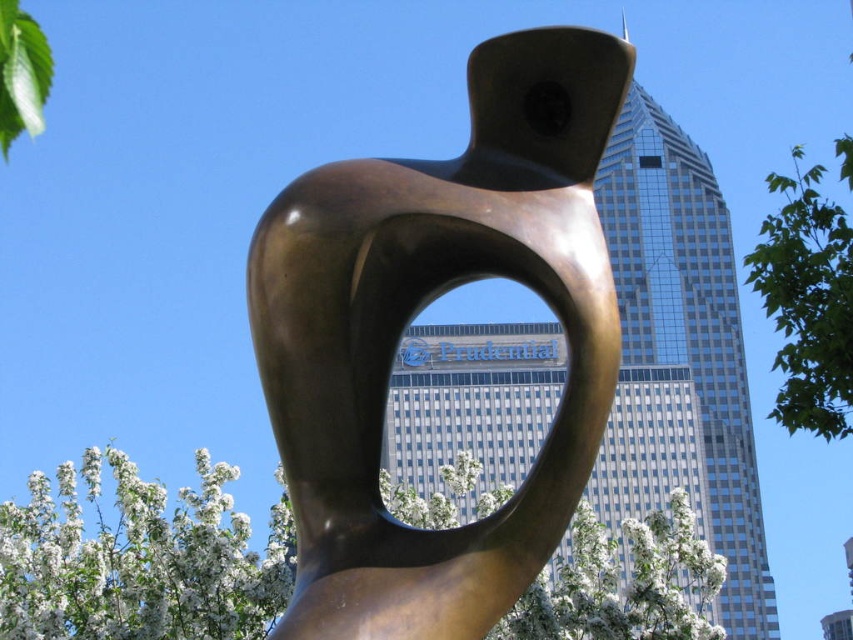
In the scene shown: Is the position of bronze sculpture at center more distant than that of green leafy tree at right?

Result: No, bronze sculpture at center is closer to the viewer.

Can you confirm if bronze sculpture at center is shorter than green leafy tree at right?

Yes.

The image size is (853, 640). Describe the element at coordinates (416, 314) in the screenshot. I see `bronze sculpture at center` at that location.

The width and height of the screenshot is (853, 640). I want to click on bronze sculpture at center, so click(x=416, y=314).

Does white blossoms at center have a lesser width compared to green leafy tree at right?

In fact, white blossoms at center might be wider than green leafy tree at right.

Is white blossoms at center below green leafy tree at right?

Yes, white blossoms at center is below green leafy tree at right.

Is point (431, 500) positioned in front of point (815, 320)?

No.

The image size is (853, 640). In order to click on white blossoms at center in this screenshot , I will do `click(138, 560)`.

From the picture: Can you confirm if green leafy tree at right is shorter than green leafy tree at upper left?

In fact, green leafy tree at right may be taller than green leafy tree at upper left.

Between point (819, 323) and point (12, 76), which one is positioned behind?

Point (12, 76)

Which is in front, point (834, 228) or point (48, 93)?

Positioned in front is point (834, 228).

You are a GUI agent. You are given a task and a screenshot of the screen. Output one action in this format:
    pyautogui.click(x=<x>, y=<y>)
    Task: Click on the green leafy tree at right
    The width and height of the screenshot is (853, 640).
    Given the screenshot: What is the action you would take?
    pyautogui.click(x=807, y=301)